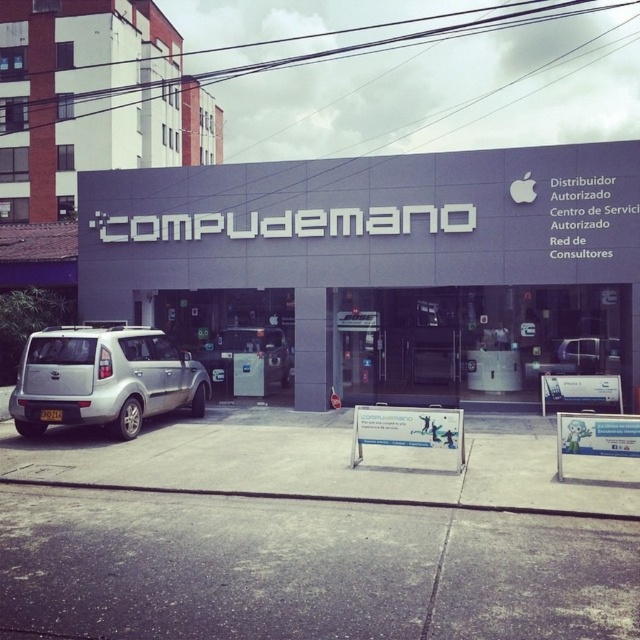
Question: Where is matte gray building at center located in relation to silver metallic van at lower left in the image?

Choices:
 (A) left
 (B) right

Answer: (B)

Question: Does matte gray building at center have a smaller size compared to silver metallic van at lower left?

Choices:
 (A) no
 (B) yes

Answer: (A)

Question: Can you confirm if matte gray building at center is positioned below silver metallic van at lower left?

Choices:
 (A) no
 (B) yes

Answer: (A)

Question: Which object appears farthest from the camera in this image?

Choices:
 (A) matte gray building at center
 (B) silver metallic van at lower left

Answer: (A)

Question: Which point is closer to the camera?

Choices:
 (A) (525, 401)
 (B) (113, 337)

Answer: (B)

Question: Which object appears farthest from the camera in this image?

Choices:
 (A) matte gray building at center
 (B) silver metallic van at lower left

Answer: (A)